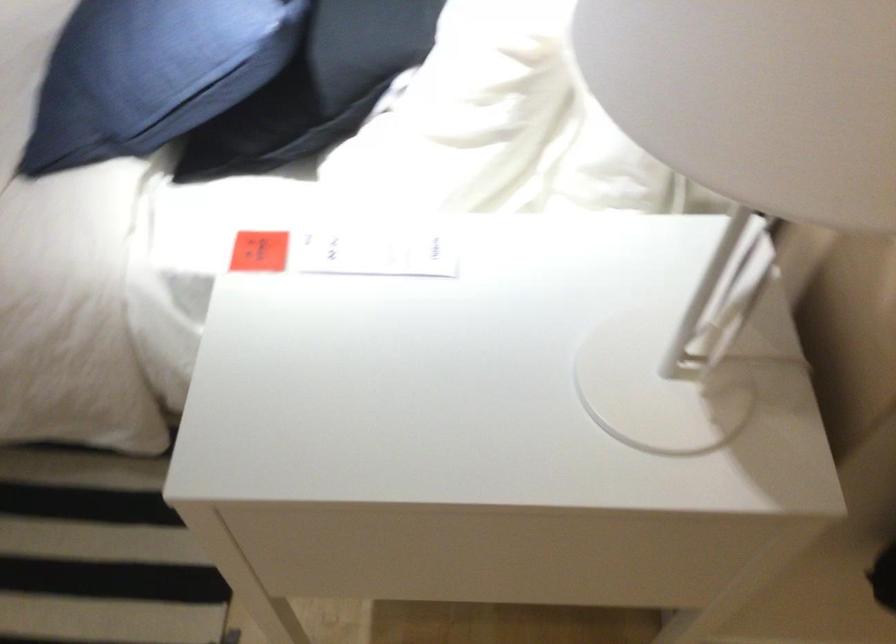
What do you see at coordinates (375, 252) in the screenshot? This screenshot has height=644, width=896. I see `a paper price tag` at bounding box center [375, 252].